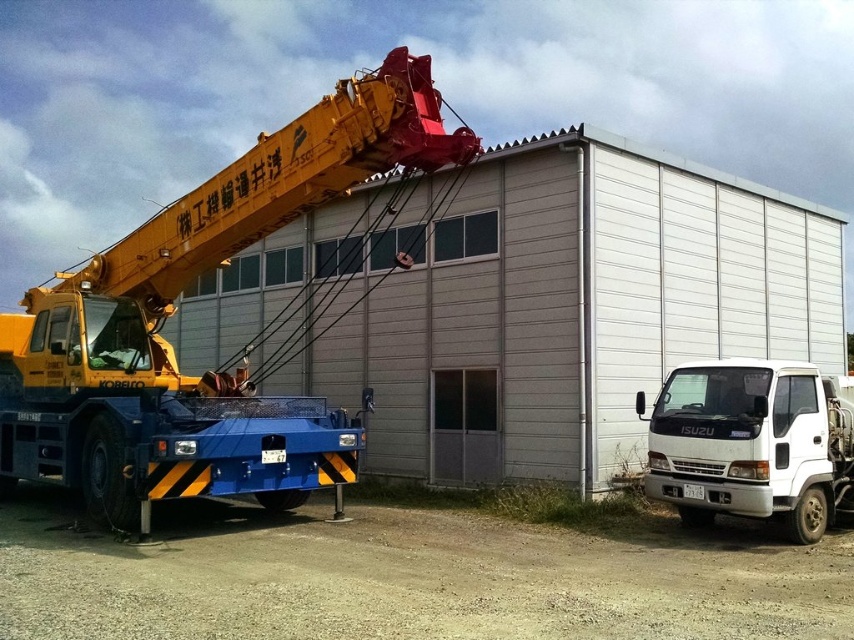
Question: Does yellow metallic crane at left have a greater width compared to white matte truck at lower right?

Choices:
 (A) no
 (B) yes

Answer: (B)

Question: Is yellow metallic crane at left to the right of white matte truck at lower right from the viewer's perspective?

Choices:
 (A) yes
 (B) no

Answer: (B)

Question: Which object appears closest to the camera in this image?

Choices:
 (A) yellow metallic crane at left
 (B) white matte truck at lower right

Answer: (A)

Question: Which point appears closest to the camera in this image?

Choices:
 (A) (808, 401)
 (B) (273, 132)

Answer: (A)

Question: Where is yellow metallic crane at left located in relation to white matte truck at lower right in the image?

Choices:
 (A) right
 (B) left

Answer: (B)

Question: Which object is farther from the camera taking this photo?

Choices:
 (A) yellow metallic crane at left
 (B) white matte truck at lower right

Answer: (B)